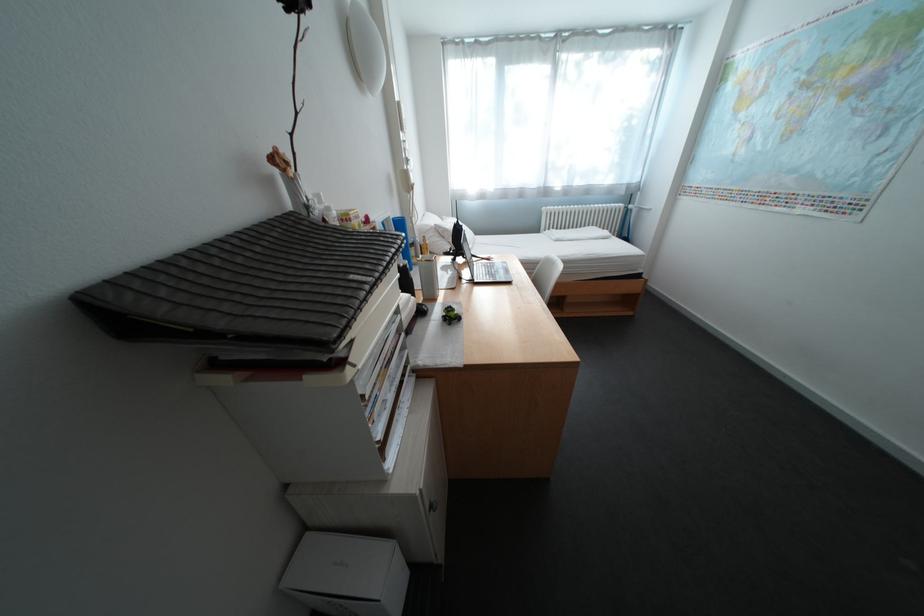
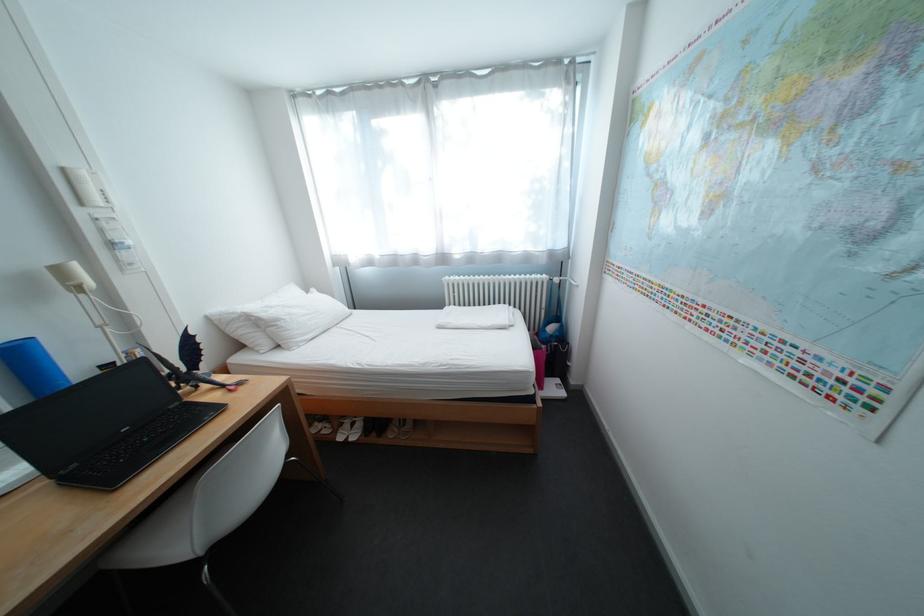
The point at (x=653, y=272) is marked in the first image. Where is the corresponding point in the second image?

(544, 392)